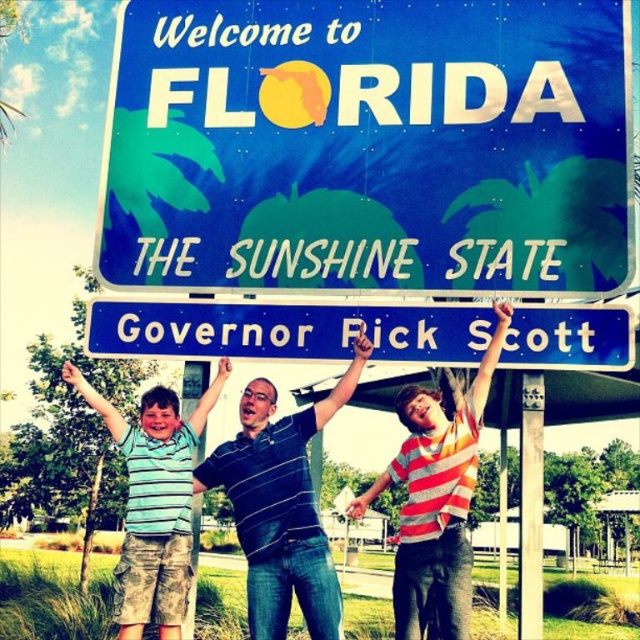
What are the coordinates of the blue metallic street sign at center in the image?

The blue metallic street sign at center is located at coordinates point (288, 330).

You are a photographer trying to capture a clear photo of the green striped shirt at center and the white painted wood pole at center. Since the pole is behind the shirt, will the pole be visible in the photo?

The white painted wood pole at center is behind the green striped shirt at center, so the pole may be partially or fully obscured depending on the shirt material and positioning. If the shirt is opaque, the pole might not be visible, but if it allows some light through, parts of the pole could show.